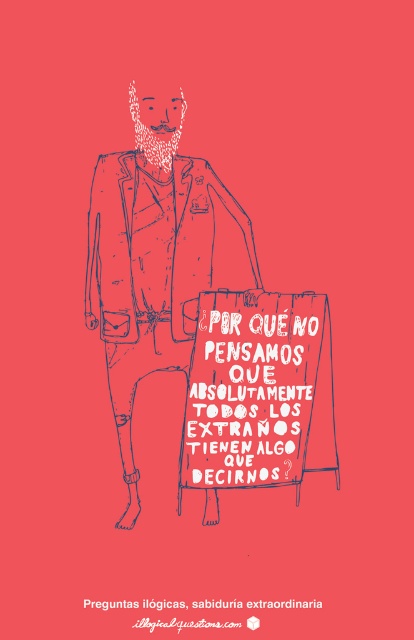
Is blue sketchy jacket at center taller than red cardboard sign at center?

Yes.

Does point (161, 257) come behind point (301, 292)?

No, (161, 257) is closer to viewer.

Which is behind, point (132, 244) or point (214, 292)?

The point (214, 292) is behind.

At what (x,y) coordinates should I click in order to perform the action: click on blue sketchy jacket at center. Please return your answer as a coordinate pair (x, y). Image resolution: width=414 pixels, height=640 pixels. Looking at the image, I should click on pos(156,259).